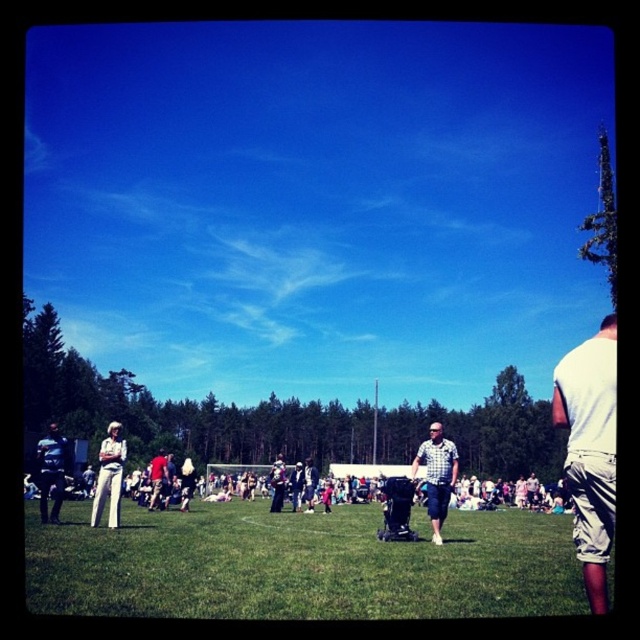
Is point (257, 570) closer to camera compared to point (106, 481)?

Yes, point (257, 570) is closer to viewer.

Measure the distance between green grass at center and camera.

green grass at center and camera are 13.94 meters apart.

This screenshot has height=640, width=640. In order to click on green grass at center in this screenshot , I will do point(301,564).

Between point (125, 449) and point (154, 480), which one is positioned in front?

Positioned in front is point (125, 449).

Is point (93, 502) positioned in front of point (157, 460)?

Yes.

Which is in front, point (97, 502) or point (157, 468)?

Point (97, 502)

What are the coordinates of `white cotton pants at lower left` in the screenshot? It's located at (109, 476).

Which is behind, point (586, 438) or point (445, 509)?

Point (445, 509)

Is the position of white cotton shirt at right less distant than that of checkered shirt at center?

That is True.

Is point (573, 452) positioned after point (438, 433)?

That is False.

Locate an element on the screen. This screenshot has width=640, height=640. white cotton shirt at right is located at coordinates (589, 451).